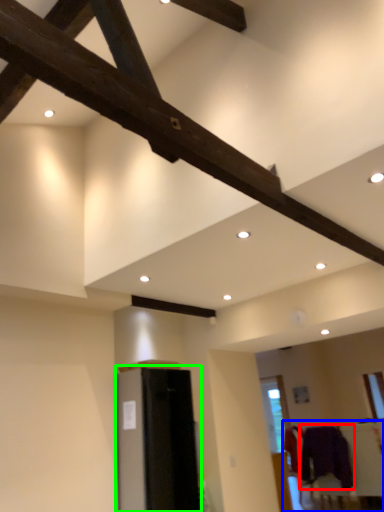
Question: Which object is the closest to the clothing (highlighted by a red box)? Choose among these: furniture (highlighted by a blue box) or furniture (highlighted by a green box).

Choices:
 (A) furniture
 (B) furniture

Answer: (A)